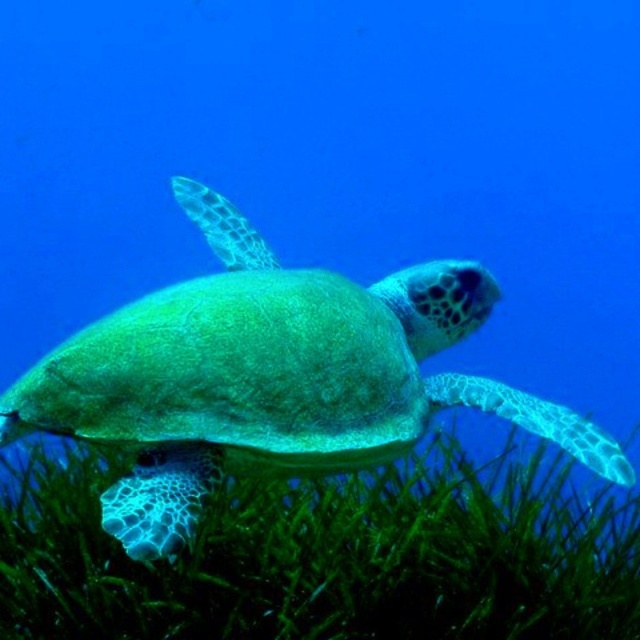
You are a marine biologist observing a sea turtle underwater. You notice a specific point at coordinates point (512,573) that is crucial for your research. If your underwater camera has a maximum focus range of 5 feet, can you capture clear images of that point?

The distance between point (512,573) and the camera is 5.20 feet, which exceeds the camera maximum focus range of 5 feet. Therefore, the camera cannot capture clear images of that point.

You are a marine biologist observing the underwater scene. You notice the green leafy grass at lower center and the green matte turtle at center. Which object is positioned lower in the image?

The green leafy grass at lower center is positioned below the green matte turtle at center, so it is the lower object.

You are a marine biologist observing the underwater scene. You need to determine which object is wider between the green leafy grass at lower center and the green matte turtle at center. Which one is wider?

The green leafy grass at lower center is wider than the green matte turtle at center according to the description.